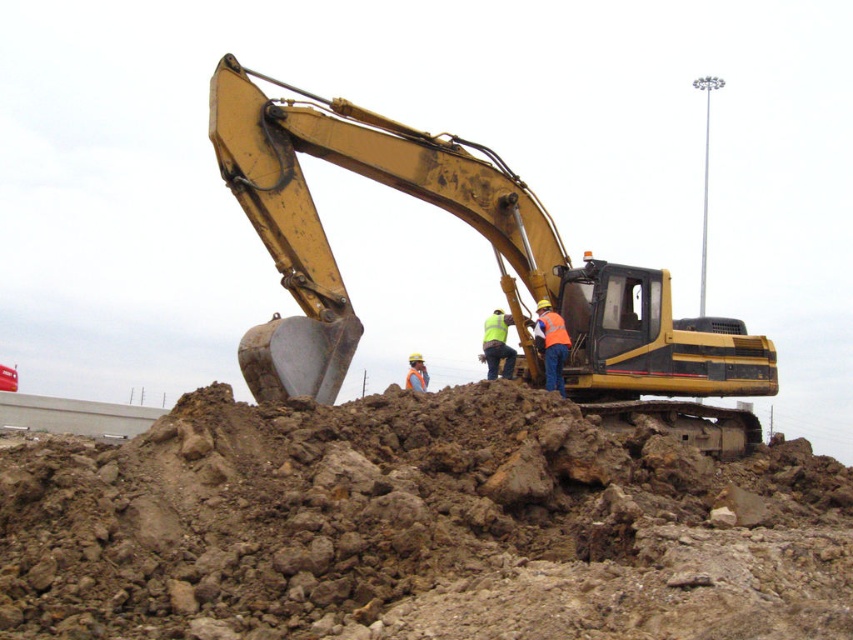
Describe the element at coordinates (418, 525) in the screenshot. Image resolution: width=853 pixels, height=640 pixels. I see `brown rocky dirt at center` at that location.

Can you confirm if brown rocky dirt at center is thinner than yellow metallic excavator at center?

No.

The image size is (853, 640). What do you see at coordinates (418, 525) in the screenshot? I see `brown rocky dirt at center` at bounding box center [418, 525].

The width and height of the screenshot is (853, 640). In order to click on brown rocky dirt at center in this screenshot , I will do `click(418, 525)`.